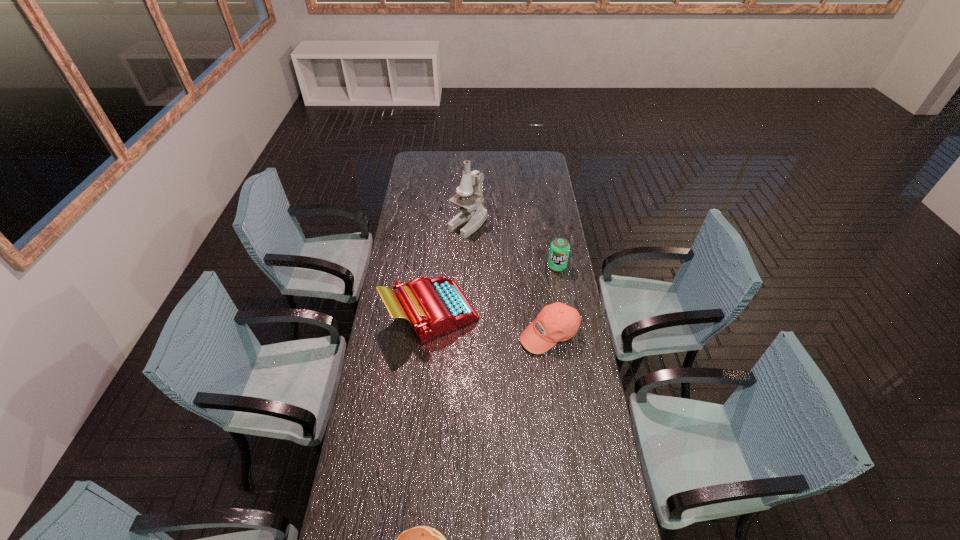
Where is `pop soda at the right edge`? pop soda at the right edge is located at coordinates (559, 250).

I want to click on baseball cap located in the right edge section of the desktop, so click(x=556, y=322).

In the image, there is a desktop. At what (x,y) coordinates should I click in order to perform the action: click on vacant space at the far edge. Please return your answer as a coordinate pair (x, y). The height and width of the screenshot is (540, 960). Looking at the image, I should click on (458, 164).

The width and height of the screenshot is (960, 540). I want to click on vacant space at the left edge, so click(x=391, y=450).

Where is `vacant space at the right edge of the desktop`? The height and width of the screenshot is (540, 960). vacant space at the right edge of the desktop is located at coordinates click(x=532, y=211).

Identify the location of vacant area at the far left corner of the desktop. (430, 161).

The height and width of the screenshot is (540, 960). Find the location of `free region at the far right corner`. free region at the far right corner is located at coordinates (532, 160).

At what (x,y) coordinates should I click in order to perform the action: click on free space between the microscope and the second tallest object. Please return your answer as a coordinate pair (x, y). The image size is (960, 540). Looking at the image, I should click on click(449, 269).

The height and width of the screenshot is (540, 960). I want to click on free area in between the baseball cap and the microscope, so click(x=509, y=279).

What are the coordinates of `free space between the typewriter and the pop soda` in the screenshot? It's located at (494, 290).